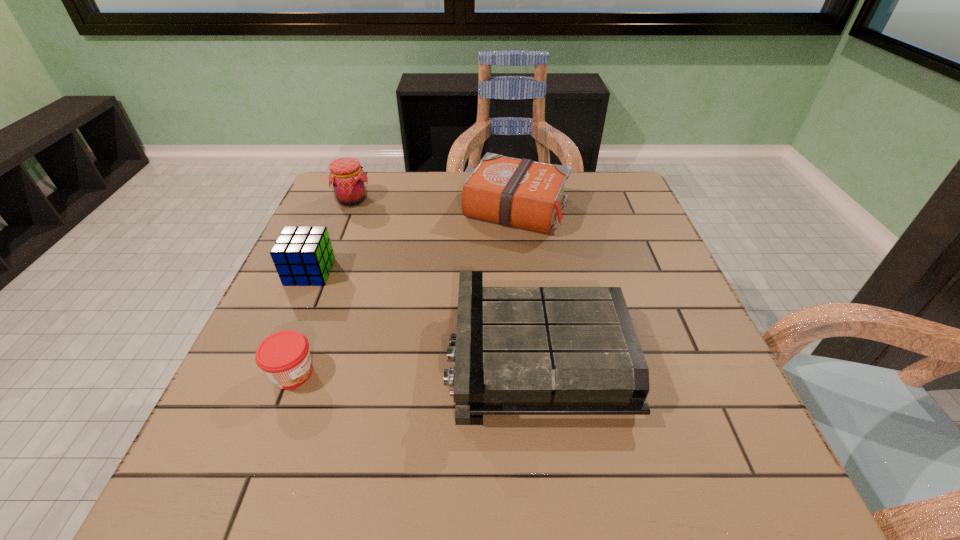
You are a GUI agent. You are given a task and a screenshot of the screen. Output one action in this format:
    pyautogui.click(x=<x>, y=<y>)
    Task: Click on the vacant space that is in between the radio receiver and the cube
    This screenshot has height=540, width=960.
    Given the screenshot: What is the action you would take?
    pyautogui.click(x=423, y=314)

Locate which object is the closest to the radio receiver. Please provide its 2D coordinates. Your answer should be formatted as a tuple, i.e. [(x, y)], where the tuple contains the x and y coordinates of a point satisfying the conditions above.

[(522, 193)]

Image resolution: width=960 pixels, height=540 pixels. I want to click on object that stands as the second closest to the radio receiver, so click(284, 356).